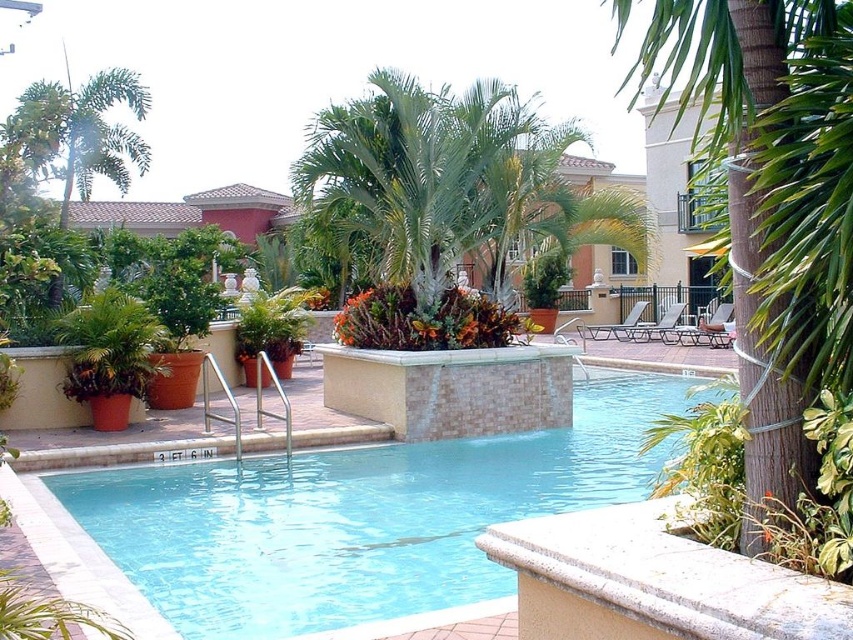
Question: Is clear blue water at center positioned in front of green leafy palm tree at center?

Choices:
 (A) no
 (B) yes

Answer: (A)

Question: Which object is closer to the camera taking this photo?

Choices:
 (A) clear blue water at center
 (B) green leafy palm tree at center

Answer: (B)

Question: Which point is farther from the camera taking this photo?

Choices:
 (A) (747, 339)
 (B) (482, 444)

Answer: (B)

Question: Is clear blue water at center bigger than green leafy palm tree at center?

Choices:
 (A) yes
 (B) no

Answer: (A)

Question: Among these objects, which one is farthest from the camera?

Choices:
 (A) clear blue water at center
 (B) green leafy palm tree at center

Answer: (A)

Question: Is clear blue water at center above green leafy palm tree at center?

Choices:
 (A) yes
 (B) no

Answer: (B)